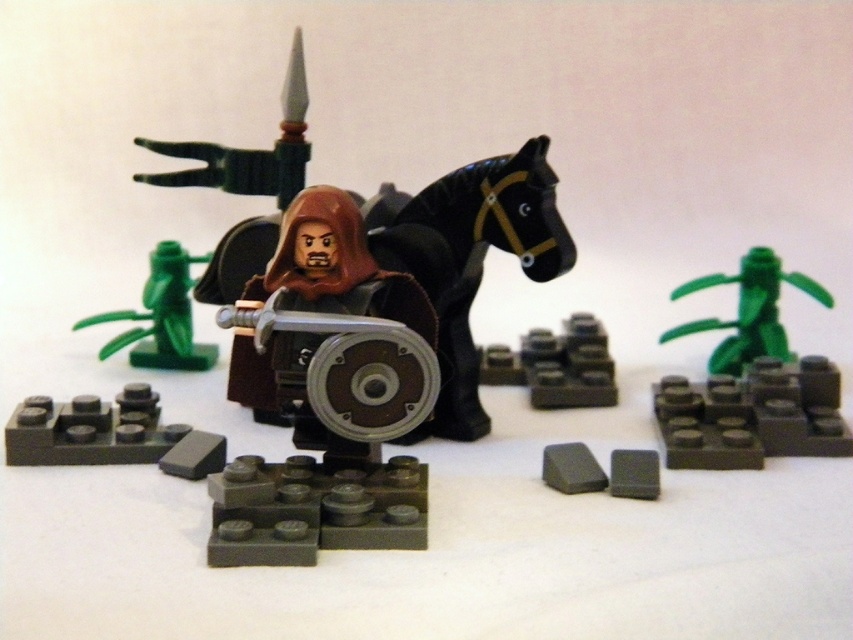
You are a LEGO builder standing 5 feet away from the scene. You want to place a new LEGO piece that is 1.5 feet long in front of the smooth gray brick at center. Is there enough space between you and the brick to fit the new piece?

The smooth gray brick at center is 3.66 feet from the viewer. Since you are 5 feet away, the distance between you and the brick is 1.34 feet. The new piece is 1.5 feet long, which is longer than the available space. Therefore, there isn

Based on the photo, you are a knight in the LEGO scene and need to move your horse to the left to avoid an incoming arrow. Which direction should you move the black matte horse at center relative to the brown matte minifigure at center?

The black matte horse at center is currently to the right of the brown matte minifigure at center. To move it to the left, you should position it so it is now to the left of the brown matte minifigure at center to avoid the arrow.

You are a LEGO builder trying to fit both the black matte horse at center and the brown matte minifigure at center into a display case that is only wide enough for the larger of the two. Which one should you place in the case first to ensure it fits?

The black matte horse at center is wider than the brown matte minifigure at center, so you should place the black matte horse at center first to ensure it fits in the display case.